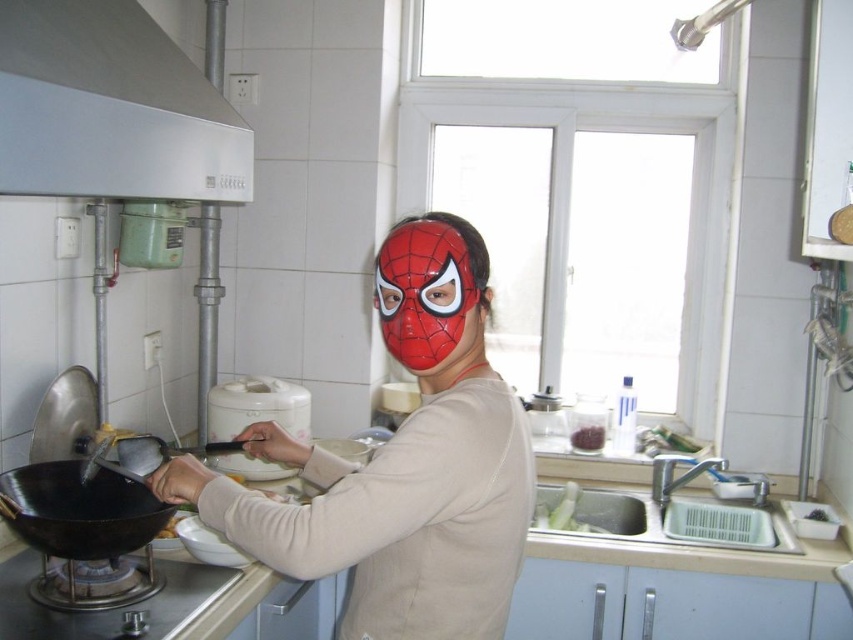
Question: Does matte red mask at center have a smaller size compared to black glossy tofu at lower center?

Choices:
 (A) no
 (B) yes

Answer: (A)

Question: Can you confirm if white glossy exhaust hood at upper left is positioned above black matte wok at lower left?

Choices:
 (A) yes
 (B) no

Answer: (A)

Question: Can you confirm if matte red mask at center is positioned above white glossy exhaust hood at upper left?

Choices:
 (A) yes
 (B) no

Answer: (B)

Question: Among these objects, which one is nearest to the camera?

Choices:
 (A) red matte mask at center
 (B) matte red mask at center
 (C) black matte wok at lower left
 (D) black glossy tofu at lower center

Answer: (B)

Question: Which object appears closest to the camera in this image?

Choices:
 (A) black glossy tofu at lower center
 (B) red matte mask at center

Answer: (B)

Question: Which point is closer to the camera taking this photo?

Choices:
 (A) (9, 500)
 (B) (50, 132)

Answer: (B)